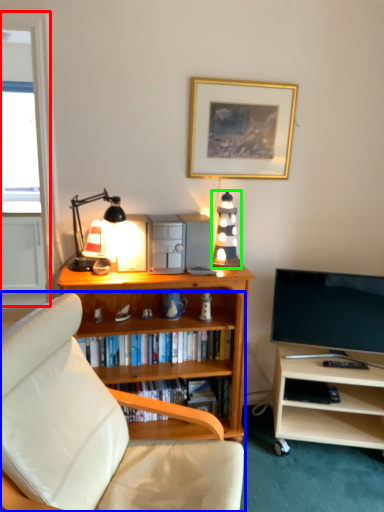
Question: Estimate the real-world distances between objects in this image. Which object is closer to glass door (highlighted by a red box), studio couch (highlighted by a blue box) or speaker (highlighted by a green box)?

Choices:
 (A) studio couch
 (B) speaker

Answer: (B)